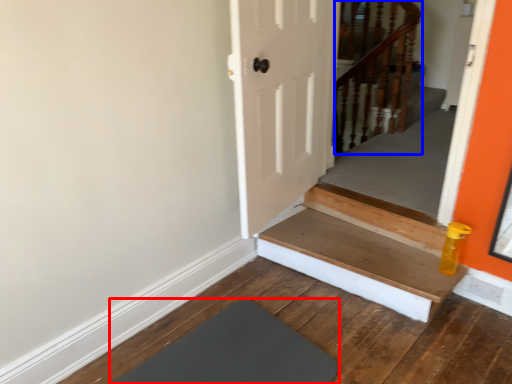
Question: Which object is closer to the camera taking this photo, mat (highlighted by a red box) or rail (highlighted by a blue box)?

Choices:
 (A) mat
 (B) rail

Answer: (A)